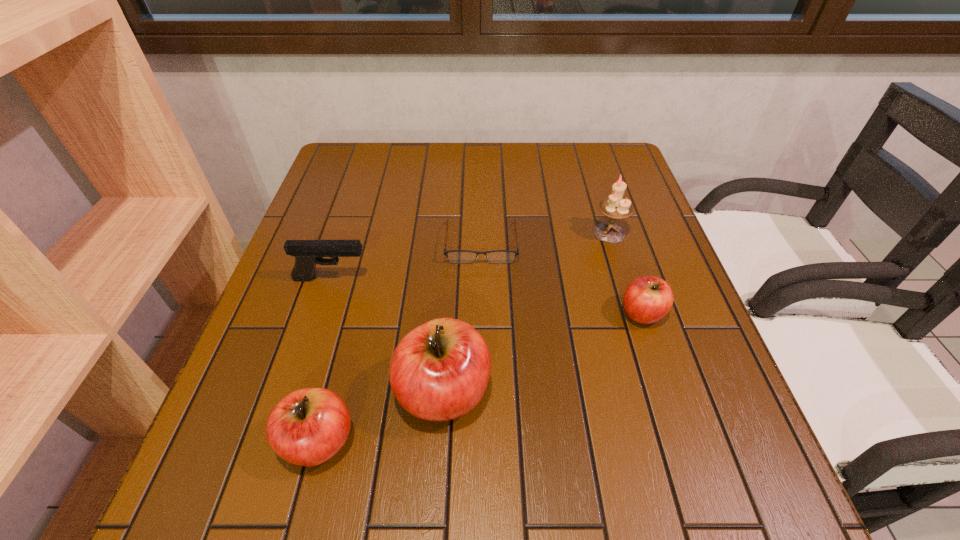
What are the coordinates of `the leftmost apple` in the screenshot? It's located at (307, 427).

Locate an element on the screen. This screenshot has height=540, width=960. the tallest apple is located at coordinates (439, 371).

What are the coordinates of `the farthest apple` in the screenshot? It's located at (647, 299).

Identify the location of the shortest apple. (647, 299).

This screenshot has height=540, width=960. What are the coordinates of `pistol` in the screenshot? It's located at tap(307, 253).

Where is `spectacles`? The image size is (960, 540). spectacles is located at coordinates (454, 256).

You are a GUI agent. You are given a task and a screenshot of the screen. Output one action in this format:
    pyautogui.click(x=<x>, y=<y>)
    Task: Click on the candle holder
    This screenshot has height=540, width=960.
    Given the screenshot: What is the action you would take?
    pyautogui.click(x=614, y=207)

This screenshot has height=540, width=960. Identify the location of free space located on the right of the second tallest apple. (481, 441).

You are a GUI agent. You are given a task and a screenshot of the screen. Output one action in this format:
    pyautogui.click(x=<x>, y=<y>)
    Task: Click on the vacant space positioned 0.230m on the back of the tallest apple
    This screenshot has height=540, width=960.
    Given the screenshot: What is the action you would take?
    pyautogui.click(x=451, y=270)

I want to click on vacant area situated on the back of the shortest apple, so click(x=623, y=256).